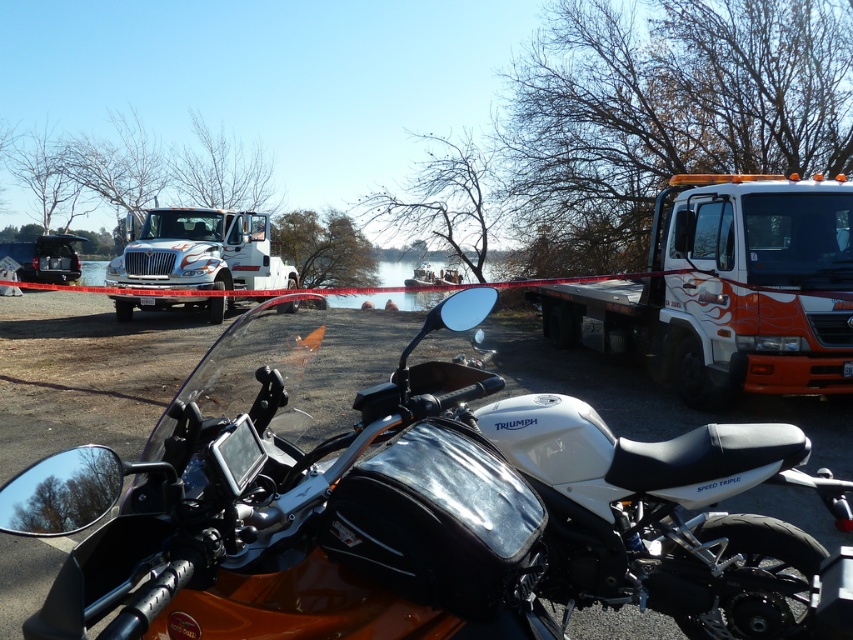
Can you confirm if white matte motorcycle at center is positioned to the left of orange flame-painted flatbed truck at right?

Indeed, white matte motorcycle at center is positioned on the left side of orange flame-painted flatbed truck at right.

Can you confirm if white matte motorcycle at center is positioned above orange flame-painted flatbed truck at right?

No, white matte motorcycle at center is not above orange flame-painted flatbed truck at right.

This screenshot has width=853, height=640. I want to click on white matte motorcycle at center, so click(407, 500).

Image resolution: width=853 pixels, height=640 pixels. What are the coordinates of `white matte motorcycle at center` in the screenshot? It's located at (407, 500).

Consider the image. Who is taller, orange flame-painted flatbed truck at right or white glossy truck at upper left?

Standing taller between the two is orange flame-painted flatbed truck at right.

Is point (601, 292) closer to viewer compared to point (181, 250)?

That is True.

The image size is (853, 640). I want to click on orange flame-painted flatbed truck at right, so point(728,291).

Locate an element on the screen. white matte motorcycle at center is located at coordinates tap(407, 500).

Where is `white matte motorcycle at center`? The width and height of the screenshot is (853, 640). white matte motorcycle at center is located at coordinates (407, 500).